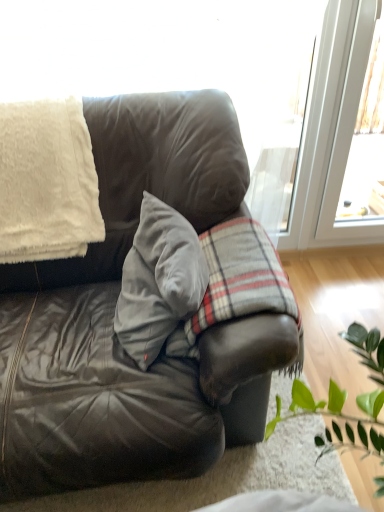
Question: In terms of width, does plaid fabric at center look wider or thinner when compared to leather couch at center?

Choices:
 (A) thin
 (B) wide

Answer: (A)

Question: From the image's perspective, is plaid fabric at center located above or below leather couch at center?

Choices:
 (A) above
 (B) below

Answer: (B)

Question: Which object is positioned farthest from the plaid fabric at center?

Choices:
 (A) velvet gray pillow at center
 (B) leather couch at center
 (C) white fluffy blanket at upper left

Answer: (C)

Question: Which of these objects is positioned farthest from the leather couch at center?

Choices:
 (A) white fluffy blanket at upper left
 (B) velvet gray pillow at center
 (C) plaid fabric at center

Answer: (A)